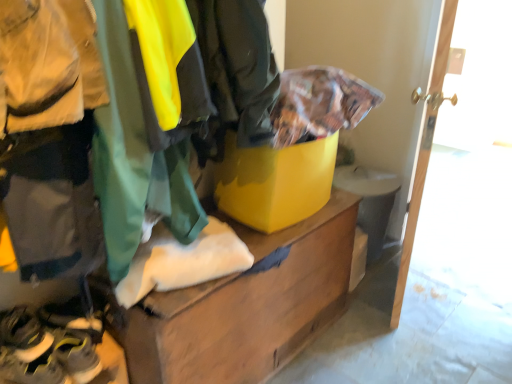
Question: Considering the relative sizes of yellow mesh sneakers at lower left, the second footwear positioned from the top, and yellow rubber shoes at lower left, which is the first footwear from top to bottom, in the image provided, is yellow mesh sneakers at lower left, the second footwear positioned from the top, bigger than yellow rubber shoes at lower left, which is the first footwear from top to bottom,?

Choices:
 (A) no
 (B) yes

Answer: (B)

Question: Would you say yellow mesh sneakers at lower left, which is the 1th footwear in bottom-to-top order, is outside yellow rubber shoes at lower left, which appears as the second footwear when ordered from the bottom?

Choices:
 (A) no
 (B) yes

Answer: (B)

Question: Considering the relative sizes of yellow mesh sneakers at lower left, the second footwear positioned from the top, and yellow rubber shoes at lower left, which is the first footwear from top to bottom, in the image provided, is yellow mesh sneakers at lower left, the second footwear positioned from the top, taller than yellow rubber shoes at lower left, which is the first footwear from top to bottom,?

Choices:
 (A) yes
 (B) no

Answer: (A)

Question: Is yellow mesh sneakers at lower left, the second footwear positioned from the top, looking in the opposite direction of yellow rubber shoes at lower left, which appears as the second footwear when ordered from the bottom?

Choices:
 (A) yes
 (B) no

Answer: (B)

Question: Can you confirm if yellow mesh sneakers at lower left, the second footwear positioned from the top, is shorter than yellow rubber shoes at lower left, which appears as the second footwear when ordered from the bottom?

Choices:
 (A) no
 (B) yes

Answer: (A)

Question: Is the depth of yellow mesh sneakers at lower left, which is the 1th footwear in bottom-to-top order, greater than that of yellow rubber shoes at lower left, which is the first footwear from top to bottom?

Choices:
 (A) yes
 (B) no

Answer: (A)

Question: Could yellow matte cardboard box at center be considered to be inside yellow rubber shoes at lower left, which is the first footwear from top to bottom?

Choices:
 (A) yes
 (B) no

Answer: (B)

Question: Does yellow rubber shoes at lower left, which appears as the second footwear when ordered from the bottom, appear on the left side of yellow matte cardboard box at center?

Choices:
 (A) no
 (B) yes

Answer: (B)

Question: Are yellow rubber shoes at lower left, which is the first footwear from top to bottom, and yellow matte cardboard box at center beside each other?

Choices:
 (A) no
 (B) yes

Answer: (A)

Question: Does yellow rubber shoes at lower left, which is the first footwear from top to bottom, have a greater width compared to yellow matte cardboard box at center?

Choices:
 (A) yes
 (B) no

Answer: (B)

Question: Is yellow matte cardboard box at center at the back of yellow rubber shoes at lower left, which appears as the second footwear when ordered from the bottom?

Choices:
 (A) yes
 (B) no

Answer: (B)

Question: Is yellow rubber shoes at lower left, which is the first footwear from top to bottom, facing towards yellow matte cardboard box at center?

Choices:
 (A) no
 (B) yes

Answer: (A)

Question: Are yellow matte cardboard box at center and wooden door at right far apart?

Choices:
 (A) no
 (B) yes

Answer: (A)